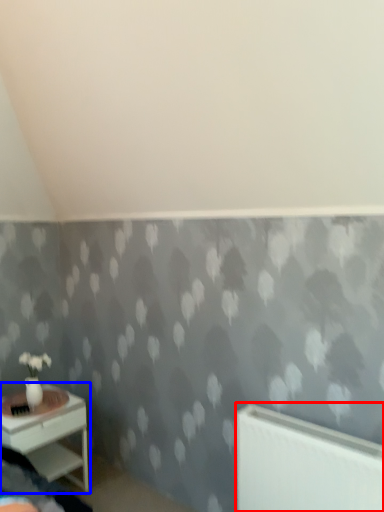
Question: Which object appears closest to the camera in this image, radiator (highlighted by a red box) or nightstand (highlighted by a blue box)?

Choices:
 (A) radiator
 (B) nightstand

Answer: (A)